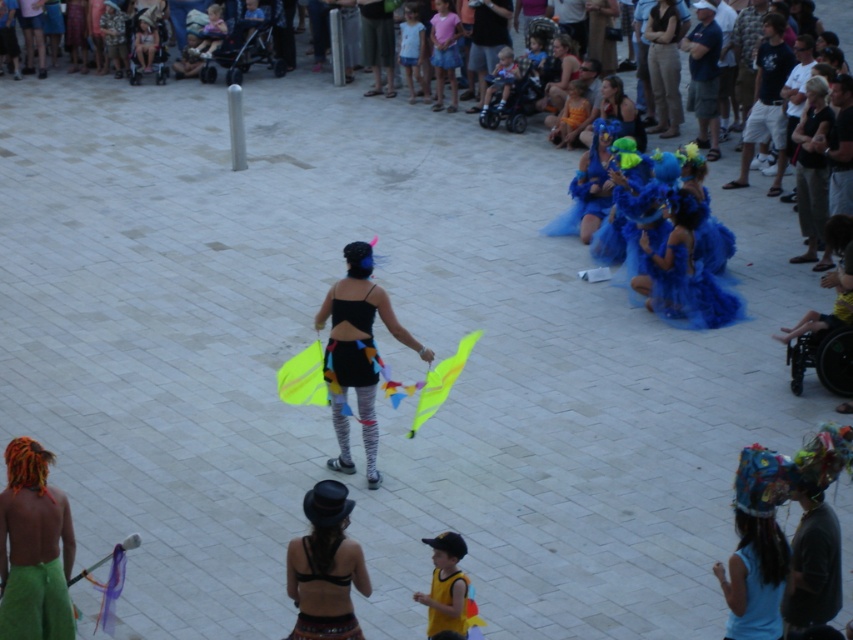
Question: Which of the following is the farthest from the observer?

Choices:
 (A) blue fabric headdress at center
 (B) fuzzy blue dress at center right
 (C) green fabric at lower left
 (D) denim pants at upper right

Answer: (D)

Question: Can you confirm if black fabric skirt at center is thinner than blue fabric at upper right?

Choices:
 (A) no
 (B) yes

Answer: (A)

Question: Which point is closer to the camera?

Choices:
 (A) (712, 148)
 (B) (688, 200)
 (C) (450, 621)

Answer: (C)

Question: Is fuzzy blue dress at center right positioned before blue fabric dress at upper right?

Choices:
 (A) no
 (B) yes

Answer: (B)

Question: Can you confirm if fuzzy blue dress at center right is thinner than dark blue t-shirt at right?

Choices:
 (A) no
 (B) yes

Answer: (A)

Question: Which point appears farthest from the camera in this image?

Choices:
 (A) (358, 305)
 (B) (318, 518)

Answer: (A)